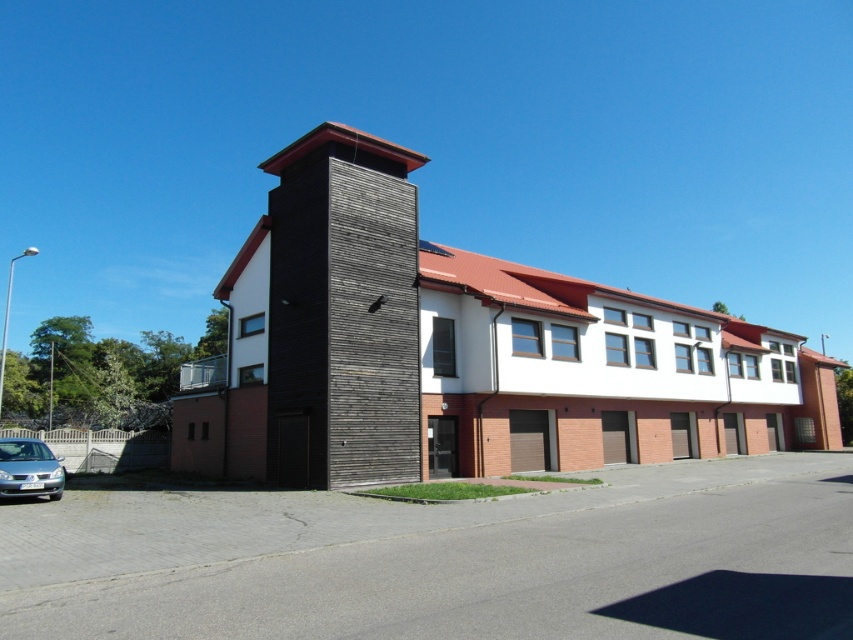
You are standing in front of the modern building described. There is a dark brown wood at center located at point (341, 310). If you want to find the dark brown wood at center, where should you look?

The dark brown wood at center is located at point (341, 310), so you should look at that coordinate to find it.

You are an architect analyzing the building layout. The dark brown wood at center is part of the facade. Can you determine its exact position relative to the building structure?

The dark brown wood at center is located at point coordinates of (341, 310) on the building structure.